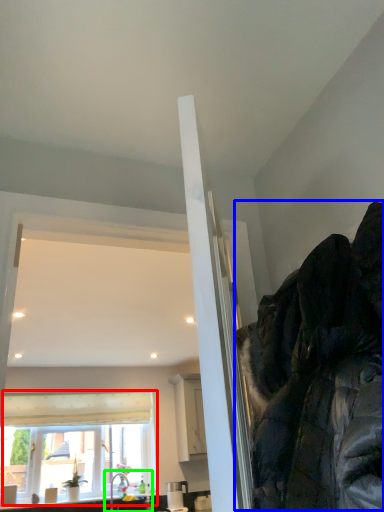
Question: Considering the real-world distances, which object is closest to window (highlighted by a red box)? jacket (highlighted by a blue box) or sink (highlighted by a green box).

Choices:
 (A) jacket
 (B) sink

Answer: (B)